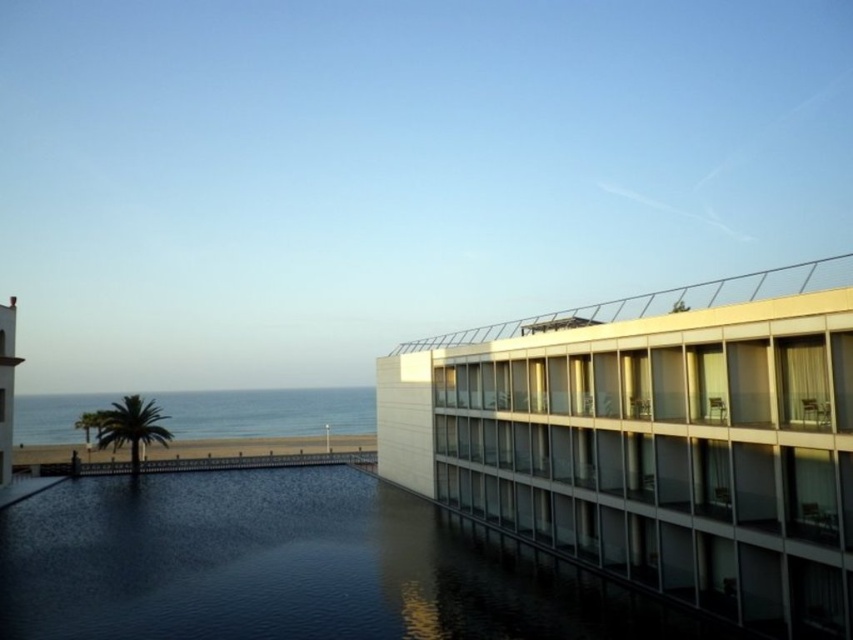
You are an architect evaluating the design of the white glass building at right and the white glass balcony at upper right. Based on their sizes, which one would require more materials for construction?

The white glass building at right requires more materials for construction because its width is larger than the white glass balcony at upper right.

You are a photographer planning to capture the smooth white tower at left and the clear blue water at lower left in a single shot. Which object will occupy more space in your photo?

The clear blue water at lower left is larger in size than the smooth white tower at left, so it will occupy more space in the photo.

You are standing in the coastal scene and want to move from the point closer to you to the point further away. Which path would you take between the two points, point (743,376) and point (12,396)?

The path from point (743,376) to point (12,396) goes from a closer point to a farther one, so you would move towards the direction where the second point is located, which is further away from you.